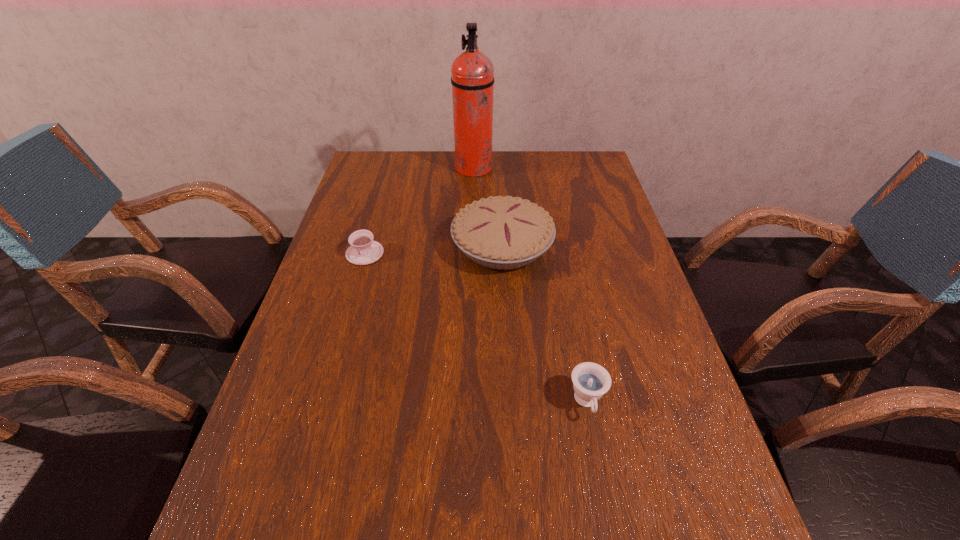
Identify the location of the farthest object. The width and height of the screenshot is (960, 540). (472, 73).

Locate an element on the screen. The height and width of the screenshot is (540, 960). the tallest object is located at coordinates (472, 73).

Locate an element on the screen. This screenshot has width=960, height=540. pie is located at coordinates (503, 233).

Find the location of a particular element. the right teacup is located at coordinates (591, 381).

You are a GUI agent. You are given a task and a screenshot of the screen. Output one action in this format:
    pyautogui.click(x=<x>, y=<y>)
    Task: Click on the taller teacup
    
    Given the screenshot: What is the action you would take?
    pyautogui.click(x=591, y=381)

Image resolution: width=960 pixels, height=540 pixels. Find the location of `the shortest object`. the shortest object is located at coordinates [363, 250].

Locate an element on the screen. the leftmost object is located at coordinates (363, 250).

Where is `vacant region located at the nozzle of the farthest object`? This screenshot has width=960, height=540. vacant region located at the nozzle of the farthest object is located at coordinates (595, 168).

The image size is (960, 540). Find the location of `vacant space situated on the back of the second tallest object`. vacant space situated on the back of the second tallest object is located at coordinates (497, 164).

Where is `vacant position located on the side of the nearest object with the handle`? This screenshot has height=540, width=960. vacant position located on the side of the nearest object with the handle is located at coordinates (611, 528).